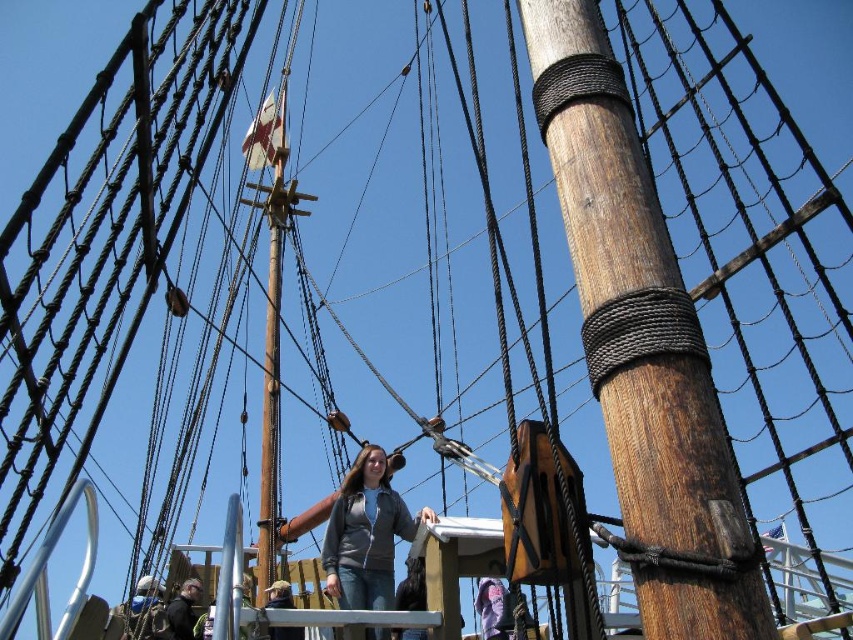
Question: Which point is closer to the camera?

Choices:
 (A) wooden pole at center
 (B) gray matte jacket at center

Answer: (A)

Question: Which point is farther from the camera taking this photo?

Choices:
 (A) (550, 92)
 (B) (352, 563)

Answer: (B)

Question: Among these objects, which one is farthest from the camera?

Choices:
 (A) wooden pole at center
 (B) gray matte jacket at center

Answer: (B)

Question: Does wooden pole at center appear over gray matte jacket at center?

Choices:
 (A) no
 (B) yes

Answer: (B)

Question: Does wooden pole at center have a greater width compared to gray matte jacket at center?

Choices:
 (A) no
 (B) yes

Answer: (A)

Question: Observing the image, what is the correct spatial positioning of wooden pole at center in reference to gray matte jacket at center?

Choices:
 (A) below
 (B) above

Answer: (B)